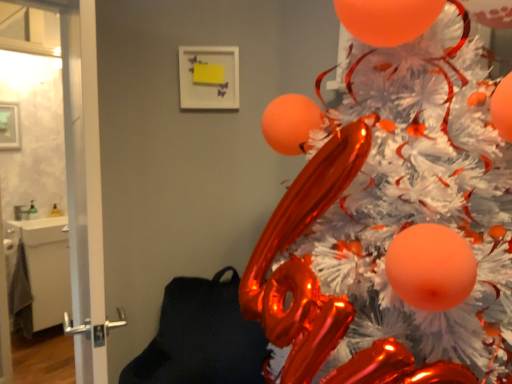
Question: Relative to shiny metallic christmas tree at upper right, is transparent glass door at left, placed as the first screen door when sorted from right to left, in front or behind?

Choices:
 (A) front
 (B) behind

Answer: (B)

Question: Is transparent glass door at left, which is counted as the 2th screen door, starting from the left, inside or outside of shiny metallic christmas tree at upper right?

Choices:
 (A) inside
 (B) outside

Answer: (B)

Question: Which object is the farthest from the white glossy door at left, positioned as the 1th screen door in left-to-right order?

Choices:
 (A) transparent glass door at left, which is counted as the 2th screen door, starting from the left
 (B) shiny metallic christmas tree at upper right

Answer: (B)

Question: Estimate the real-world distances between objects in this image. Which object is farther from the shiny metallic christmas tree at upper right?

Choices:
 (A) transparent glass door at left, which is counted as the 2th screen door, starting from the left
 (B) white glossy door at left, positioned as the 1th screen door in left-to-right order

Answer: (A)